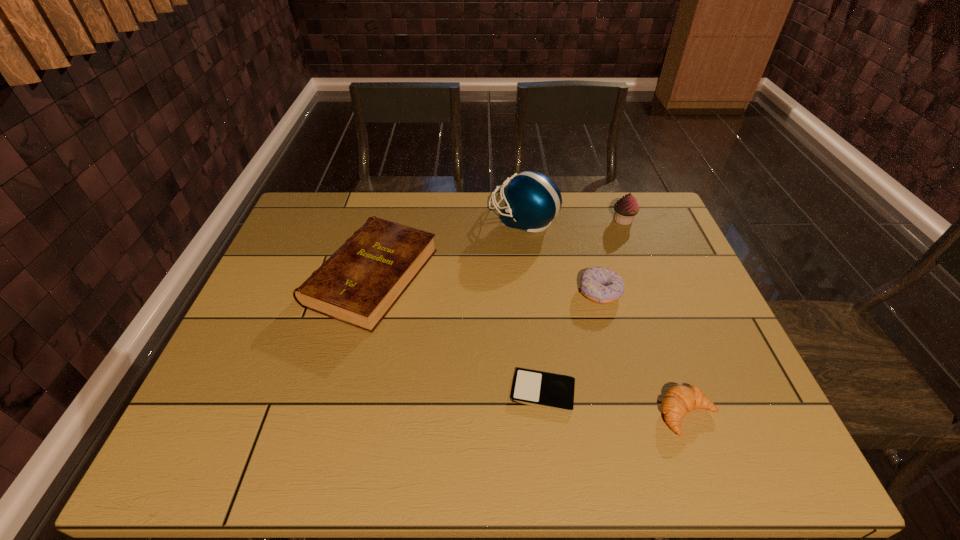
This screenshot has height=540, width=960. I want to click on vacant space situated 0.250m on the left of the second tallest object, so tap(534, 220).

Identify the location of blank space located 0.210m on the back of the leftmost object. (393, 194).

The height and width of the screenshot is (540, 960). Find the location of `vacant space located on the left of the doughnut`. vacant space located on the left of the doughnut is located at coordinates (471, 292).

What are the coordinates of `vacant space located 0.090m on the left of the crescent roll` in the screenshot? It's located at (616, 415).

Image resolution: width=960 pixels, height=540 pixels. In order to click on vacant area situated on the right of the iPod in this screenshot , I will do `click(635, 391)`.

The width and height of the screenshot is (960, 540). What are the coordinates of `football helmet located at the far edge` in the screenshot? It's located at (532, 200).

Identify the location of cupcake that is at the far edge. (626, 208).

The width and height of the screenshot is (960, 540). What are the coordinates of `hardback book at the far edge` in the screenshot? It's located at (359, 284).

Find the location of `object that is at the near edge`. object that is at the near edge is located at coordinates (680, 399).

Identify the location of object present at the left edge. This screenshot has height=540, width=960. (359, 284).